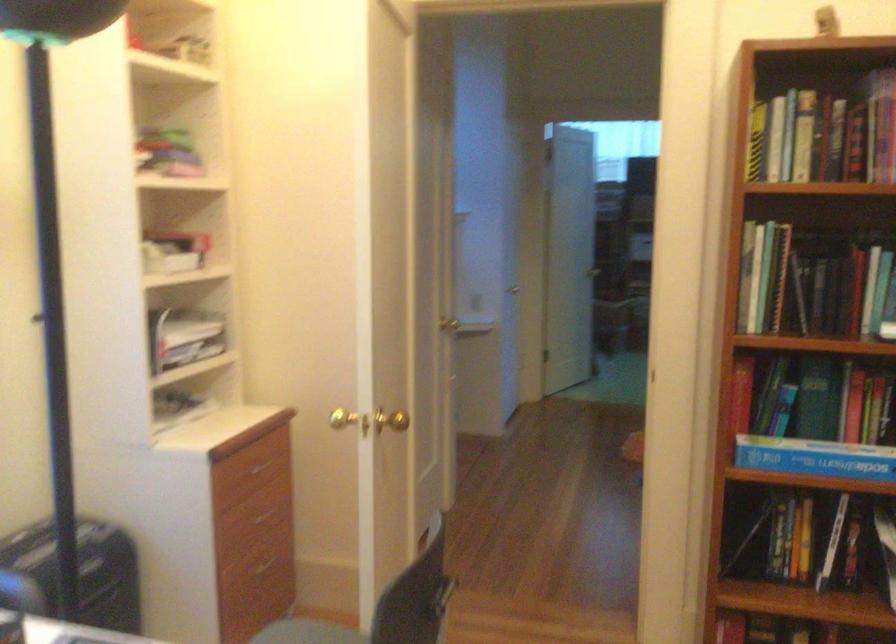
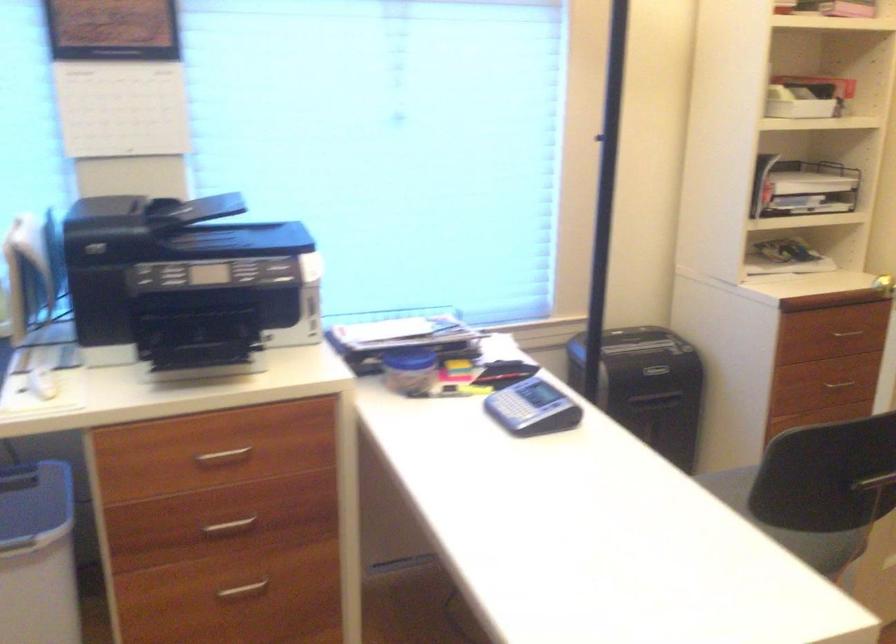
Question: How did the camera likely rotate?

Choices:
 (A) Left
 (B) Right
 (C) Up
 (D) Down

Answer: (A)